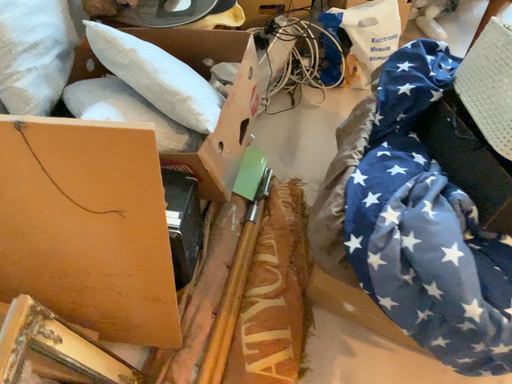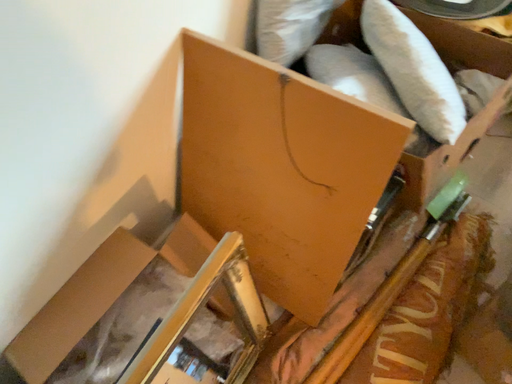
Question: How did the camera likely rotate when shooting the video?

Choices:
 (A) rotated right
 (B) rotated left

Answer: (B)